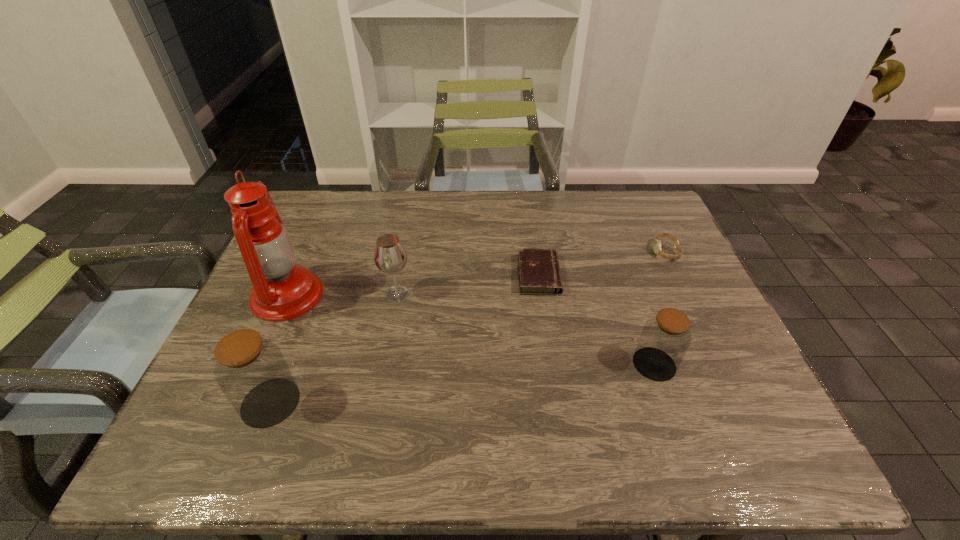
Find the location of a particular element. The width and height of the screenshot is (960, 540). vacant point located between the rightmost object and the third object from right to left is located at coordinates (602, 264).

At what (x,y) coordinates should I click in order to perform the action: click on free spot between the tallest object and the fifth object from left to right. Please return your answer as a coordinate pair (x, y). Looking at the image, I should click on (470, 330).

What are the coordinates of `free area in between the oil lamp and the third object from left to right` in the screenshot? It's located at (343, 295).

Find the location of a particular element. vacant space that's between the right jar and the watch is located at coordinates (660, 308).

What are the coordinates of `free space between the taller jar and the watch` in the screenshot? It's located at [468, 327].

Where is `vacant area that lies between the taller jar and the rightmost object`? Image resolution: width=960 pixels, height=540 pixels. vacant area that lies between the taller jar and the rightmost object is located at coordinates (468, 327).

At what (x,y) coordinates should I click in order to perform the action: click on the closest object to the rightmost object. Please return your answer as a coordinate pair (x, y). Looking at the image, I should click on (539, 272).

You are a GUI agent. You are given a task and a screenshot of the screen. Output one action in this format:
    pyautogui.click(x=<x>, y=<y>)
    Task: Click on the object that is the second closest one to the fifth object from left to right
    The image size is (960, 540).
    Given the screenshot: What is the action you would take?
    pyautogui.click(x=657, y=243)

Locate an element on the screen. vacant space that satisfies the following two spatial constraints: 1. on the back side of the tallest object; 2. on the right side of the wineglass is located at coordinates [x=288, y=294].

You are a GUI agent. You are given a task and a screenshot of the screen. Output one action in this format:
    pyautogui.click(x=<x>, y=<y>)
    Task: Click on the vacant space that satisfies the following two spatial constraints: 1. on the front side of the oil lamp; 2. on the right side of the left jar
    The height and width of the screenshot is (540, 960).
    Given the screenshot: What is the action you would take?
    pyautogui.click(x=240, y=402)